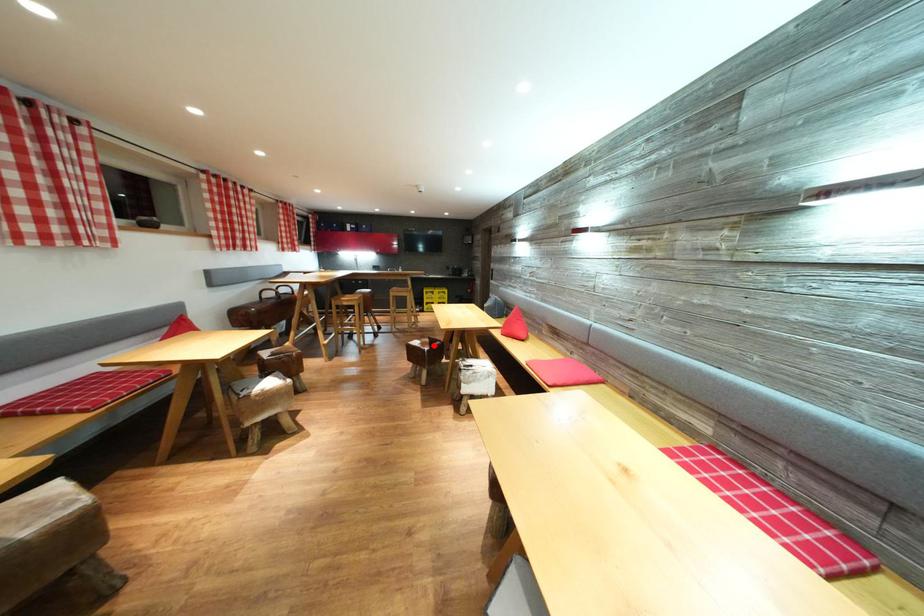
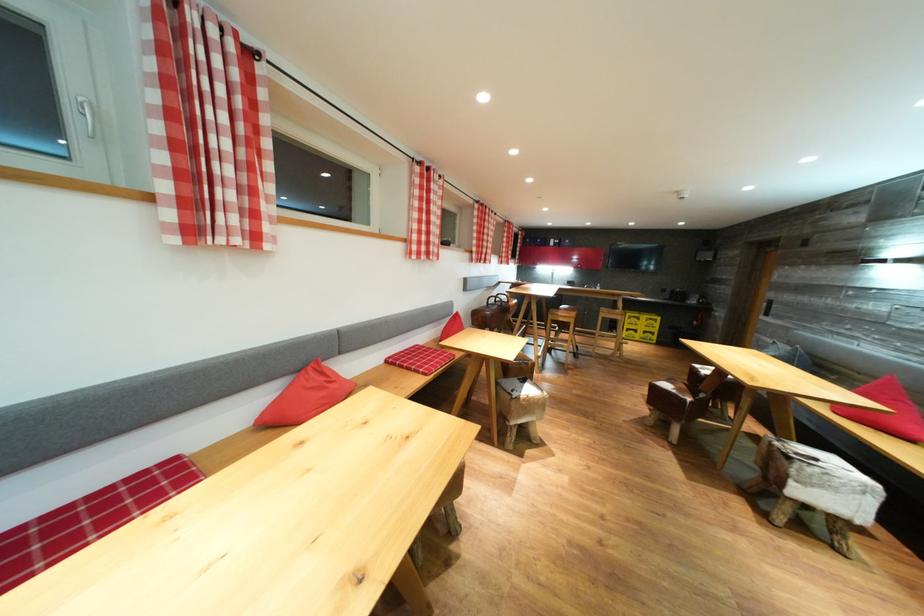
Question: I am providing you with two images of the same scene from different viewpoints. A red point is shown in image1. For the corresponding object point in image2, is it positioned nearer or farther from the camera?

Choices:
 (A) Nearer
 (B) Farther

Answer: (B)